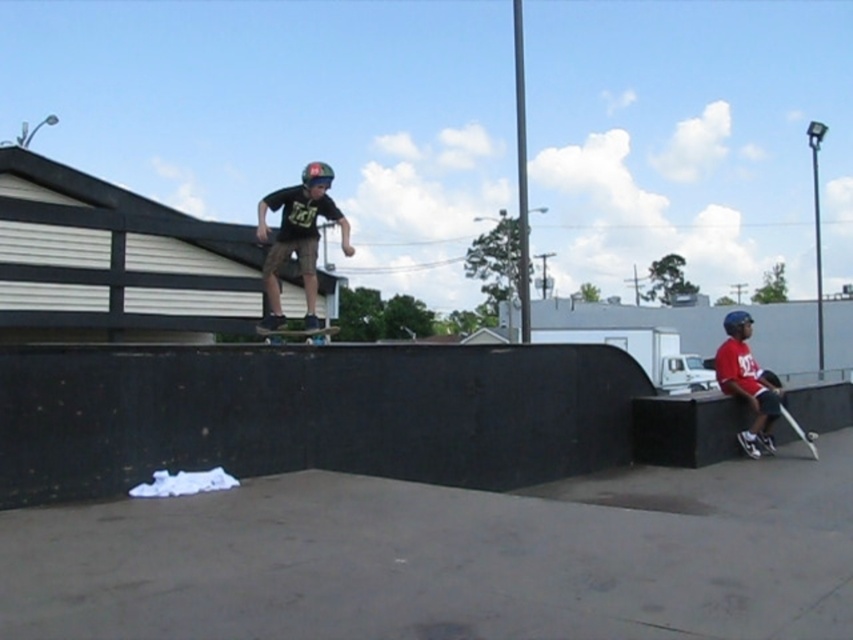
Question: Is matte black helmet at center closer to camera compared to red cotton shirt at right?

Choices:
 (A) no
 (B) yes

Answer: (B)

Question: Which of the following is the closest to the observer?

Choices:
 (A) matte black helmet at center
 (B) red cotton shirt at right

Answer: (A)

Question: Does red cotton shirt at right appear over black matte skateboard at center?

Choices:
 (A) no
 (B) yes

Answer: (A)

Question: Estimate the real-world distances between objects in this image. Which object is closer to the black matte skateboard at lower right?

Choices:
 (A) red cotton shirt at right
 (B) black matte skateboard at center
 (C) matte black helmet at center

Answer: (A)

Question: Which point is farther to the camera?

Choices:
 (A) red cotton shirt at right
 (B) black matte skateboard at center
 (C) matte black helmet at center
 (D) black matte skateboard at lower right

Answer: (A)

Question: Does matte black helmet at center appear on the right side of red cotton shirt at right?

Choices:
 (A) yes
 (B) no

Answer: (B)